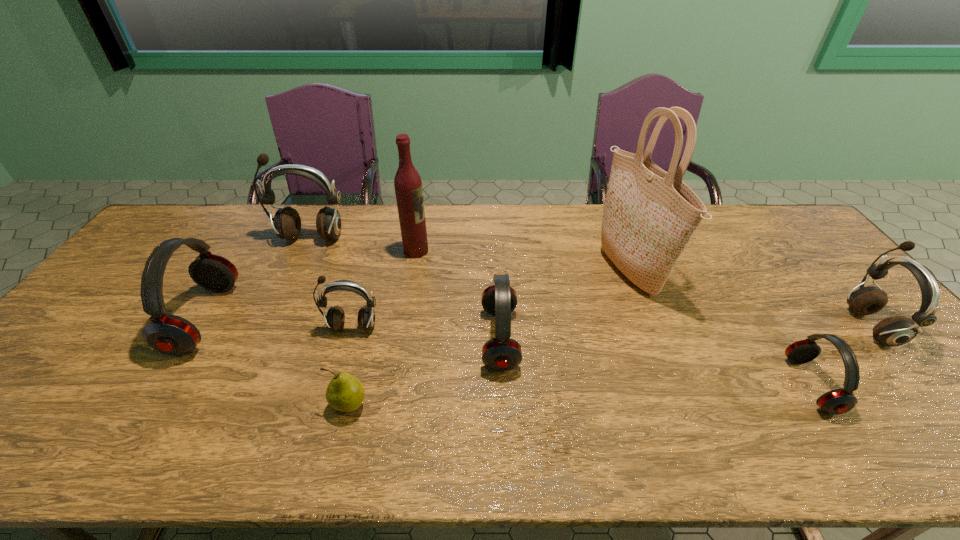
Locate an element on the screen. This screenshot has width=960, height=540. shopping bag is located at coordinates (650, 215).

Identify the location of the tallest object. (650, 215).

I want to click on the fifth object from left to right, so click(408, 186).

The image size is (960, 540). Find the location of `dark liquor`. dark liquor is located at coordinates (408, 186).

Find the location of a particular element. the biggest brown earphone is located at coordinates (287, 223).

Identify the location of the seventh shortest object. The height and width of the screenshot is (540, 960). (287, 223).

I want to click on the biggest red earphone, so click(169, 334).

I want to click on the second smallest brown earphone, so (893, 331).

Where is `the rightmost brown earphone`? This screenshot has width=960, height=540. the rightmost brown earphone is located at coordinates (893, 331).

The width and height of the screenshot is (960, 540). In order to click on the second red earphone from right to left in this screenshot , I will do `click(502, 353)`.